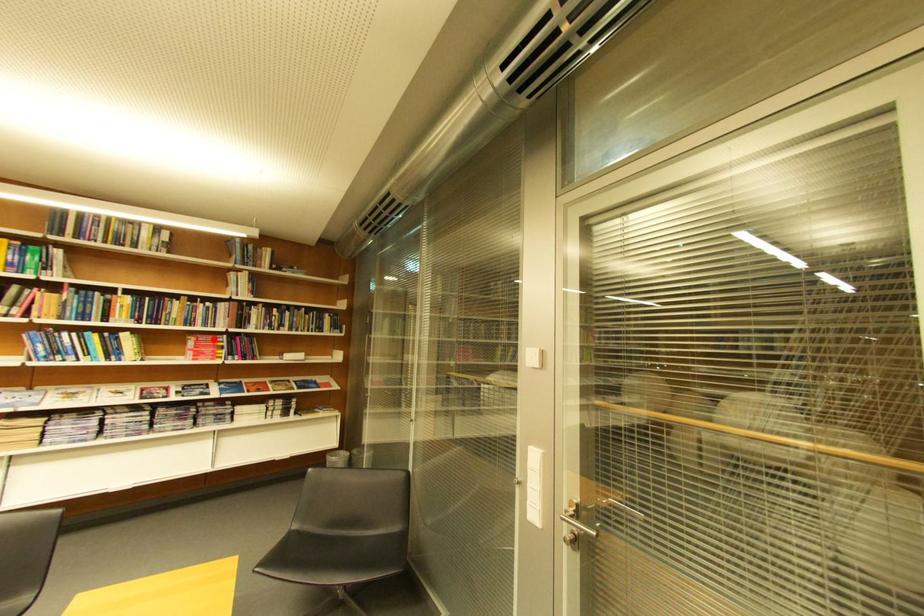
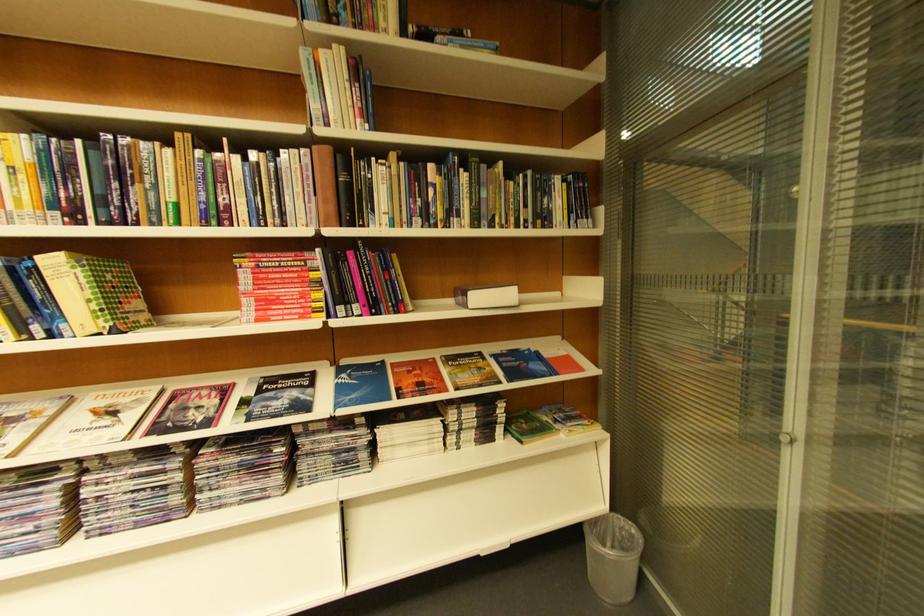
In the second image, find the point that corresponds to the highlighted location in the first image.

(281, 262)